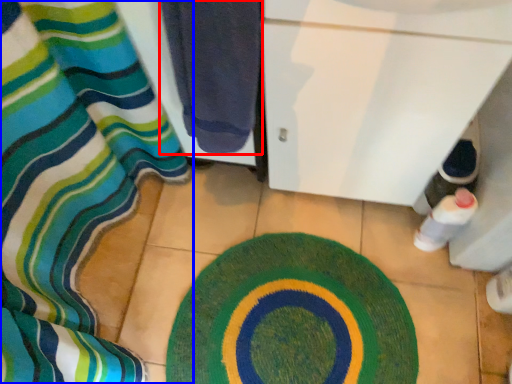
Question: Which object appears closest to the camera in this image, towel (highlighted by a red box) or curtain (highlighted by a blue box)?

Choices:
 (A) towel
 (B) curtain

Answer: (A)